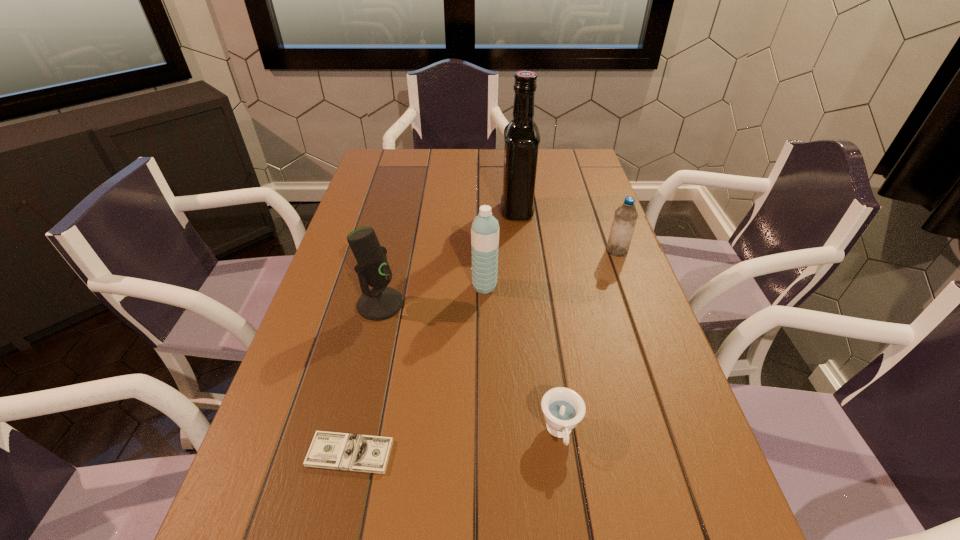
Find the location of a particular element. This screenshot has width=960, height=540. the farthest object is located at coordinates (522, 138).

Image resolution: width=960 pixels, height=540 pixels. Find the location of `liquor`. liquor is located at coordinates (522, 138).

Locate an element on the screen. the nearer water bottle is located at coordinates (485, 228).

Image resolution: width=960 pixels, height=540 pixels. What are the coordinates of `the fourth object from right to left` in the screenshot? It's located at (485, 228).

The height and width of the screenshot is (540, 960). I want to click on microphone, so click(381, 302).

I want to click on the farther water bottle, so click(x=625, y=217).

Where is `the right water bottle`? The image size is (960, 540). the right water bottle is located at coordinates (625, 217).

Where is `teacup`? teacup is located at coordinates (563, 408).

Locate an element on the screen. This screenshot has width=960, height=540. dollar is located at coordinates click(343, 451).

Locate an element on the screen. The image size is (960, 540). free spot located 0.260m on the front-facing side of the farthest object is located at coordinates coord(417,210).